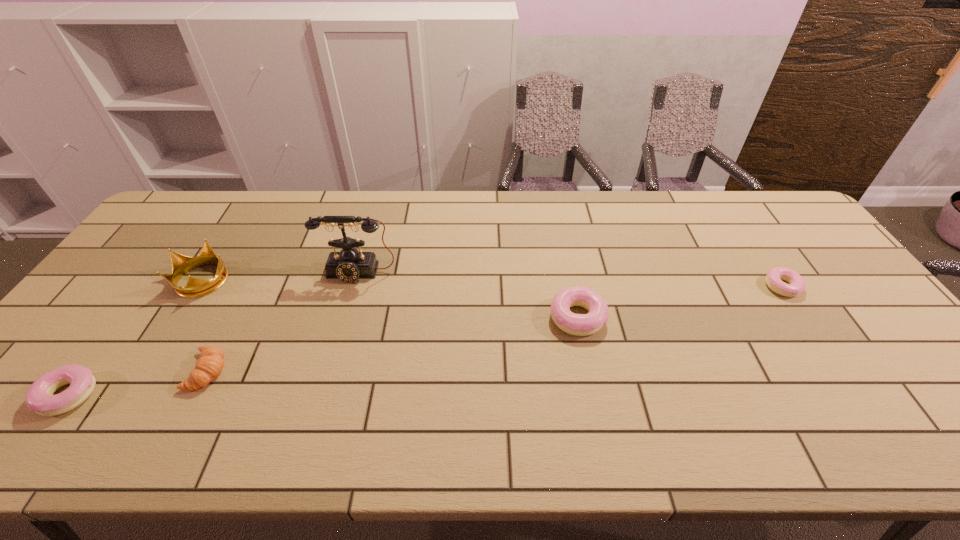
Where is `crescent roll`? This screenshot has width=960, height=540. crescent roll is located at coordinates (209, 365).

The image size is (960, 540). Find the location of `vacant space located on the right of the leftmost doughnut`. vacant space located on the right of the leftmost doughnut is located at coordinates (117, 395).

Where is `vacant area located on the right of the second doughnut from right to left`? This screenshot has width=960, height=540. vacant area located on the right of the second doughnut from right to left is located at coordinates (743, 318).

I want to click on vacant position located on the back of the shortest doughnut, so click(x=732, y=211).

The image size is (960, 540). What are the coordinates of `free space located on the dial of the telephone` in the screenshot? It's located at (336, 350).

Locate an element on the screen. vacant space located on the back of the fifth shortest object is located at coordinates (245, 213).

The width and height of the screenshot is (960, 540). What are the coordinates of `vacant region located 0.110m on the left of the crescent roll` in the screenshot? It's located at 144,371.

Find the location of a particular element. Image resolution: width=960 pixels, height=540 pixels. doughnut at the near edge is located at coordinates pyautogui.click(x=39, y=398).

Image resolution: width=960 pixels, height=540 pixels. I want to click on crescent roll present at the near edge, so click(209, 365).

Identify the location of object at the left edge. This screenshot has width=960, height=540. (39, 398).